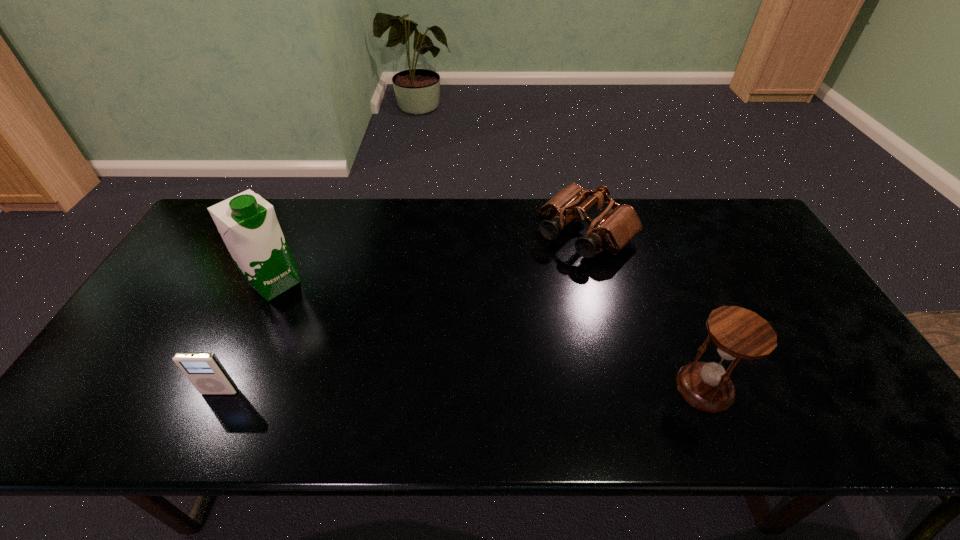
Locate an element on the screen. Image resolution: width=960 pixels, height=540 pixels. vacant space that satisfies the following two spatial constraints: 1. on the front side of the binoculars; 2. on the right side of the second tallest object is located at coordinates (626, 388).